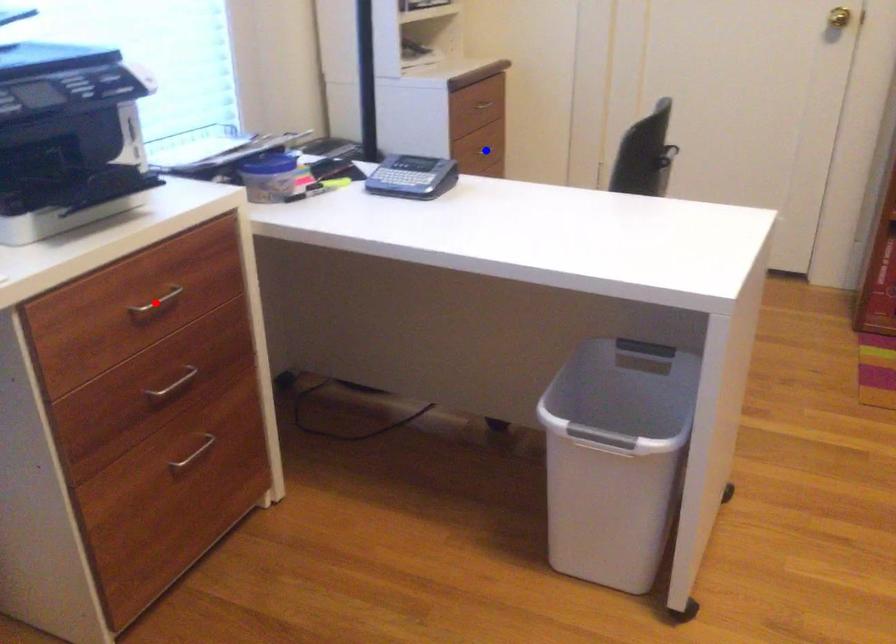
Question: Which of the two points in the image is closer to the camera?

Choices:
 (A) Blue point is closer.
 (B) Red point is closer.

Answer: (B)